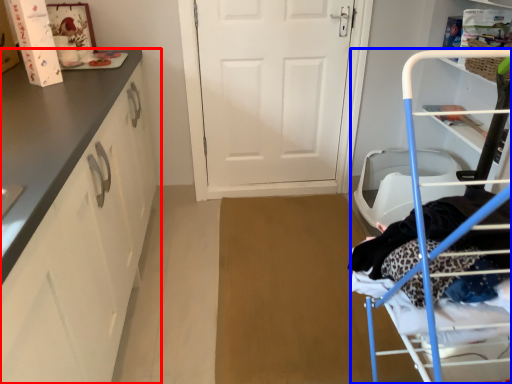
Question: Which point is closer to the camera, cabinetry (highlighted by a red box) or furniture (highlighted by a blue box)?

Choices:
 (A) cabinetry
 (B) furniture

Answer: (B)